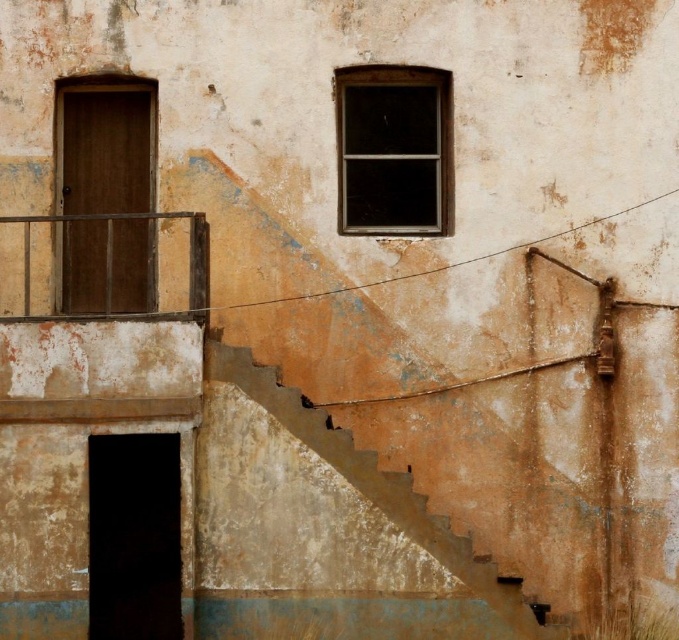
You are standing at the base of the building and want to go up to the balcony. You see the rusty concrete stairs at lower right and the rusty metal balustrade at left. Which object is closer to your right side?

The rusty concrete stairs at lower right are to the right of the rusty metal balustrade at left, so they are closer to your right side.